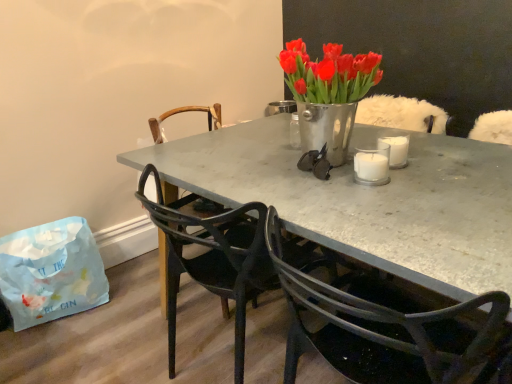
Locate an element on the screen. The width and height of the screenshot is (512, 384). free spot in front of white glass candle at center is located at coordinates point(393,195).